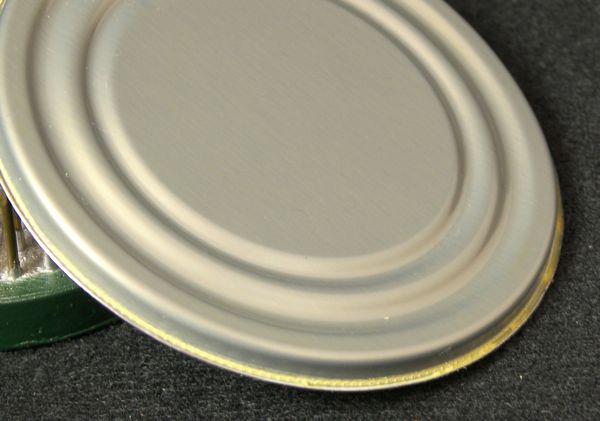
The image size is (600, 421). I want to click on looks like tupperware cover, so click(293, 147).